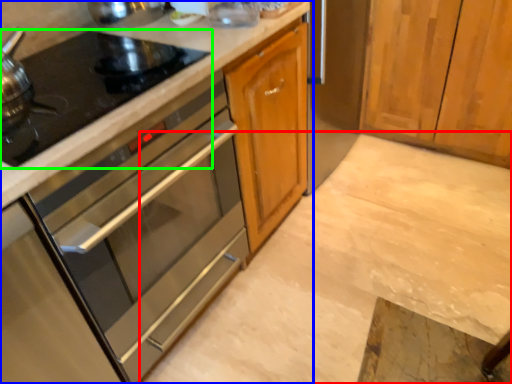
Question: Estimate the real-world distances between objects in this image. Which object is farther from concrete (highlighted by a red box), cabinetry (highlighted by a blue box) or gas stove (highlighted by a green box)?

Choices:
 (A) cabinetry
 (B) gas stove

Answer: (B)